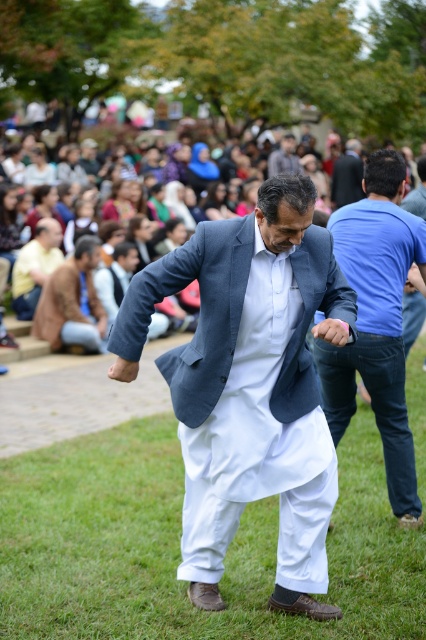
Based on the photo, is green grass at center shorter than light brown leather jacket at lower left?

Indeed, green grass at center has a lesser height compared to light brown leather jacket at lower left.

Does green grass at center have a greater width compared to light brown leather jacket at lower left?

Correct, the width of green grass at center exceeds that of light brown leather jacket at lower left.

Locate an element on the screen. green grass at center is located at coordinates (178, 547).

Is light brown leather jacket at lower left below dark blue suit at center?

Correct, light brown leather jacket at lower left is located below dark blue suit at center.

Which is above, light brown leather jacket at lower left or dark blue suit at center?

dark blue suit at center is higher up.

Is point (13, 284) positioned behind point (337, 196)?

No, (13, 284) is in front of (337, 196).

This screenshot has width=426, height=640. I want to click on light brown leather jacket at lower left, so click(36, 266).

Is matte blue suit at center wider than dark blue suit at center?

Yes, matte blue suit at center is wider than dark blue suit at center.

From the picture: Who is taller, matte blue suit at center or dark blue suit at center?

matte blue suit at center is taller.

Does point (305, 492) come farther from viewer compared to point (344, 192)?

No, it is not.

The image size is (426, 640). Identify the location of matte blue suit at center. (250, 387).